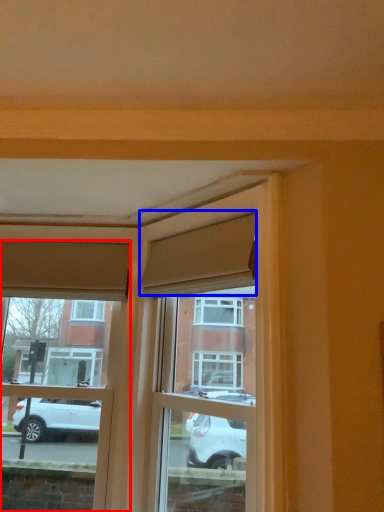
Question: Among these objects, which one is nearest to the camera, window (highlighted by a red box) or curtain (highlighted by a blue box)?

Choices:
 (A) window
 (B) curtain

Answer: (B)